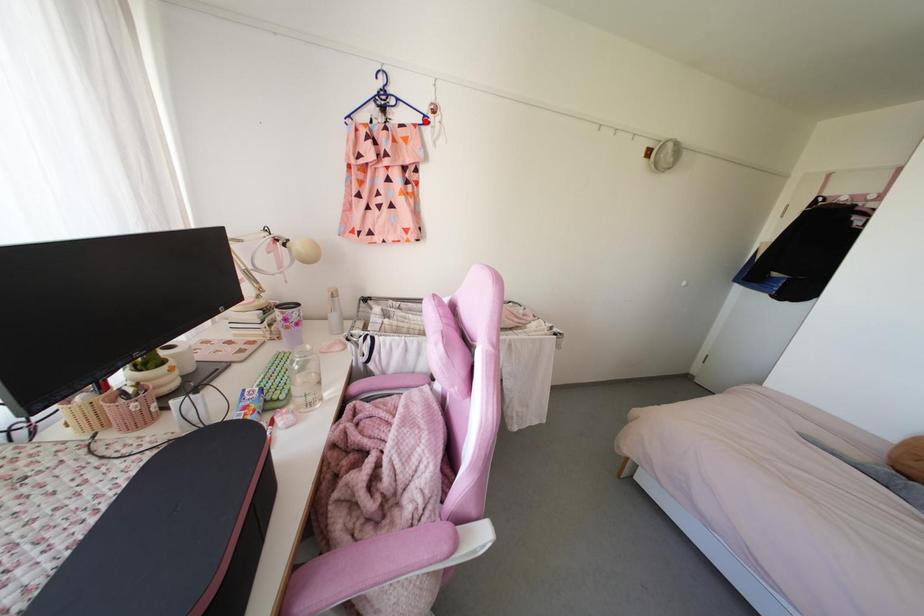
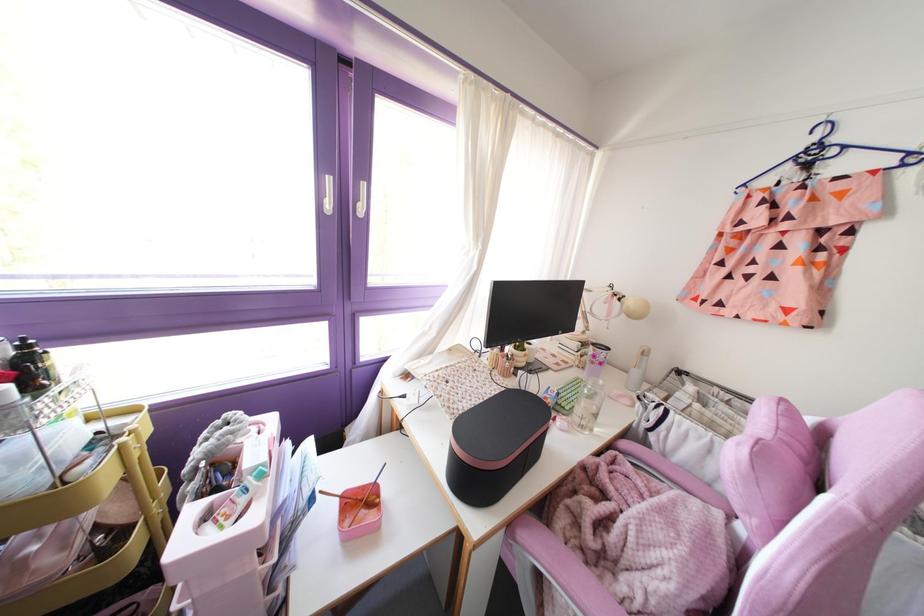
Question: I am providing you with two images of the same scene from different viewpoints. Given a red point in image1, look at the same physical point in image2. Is it:

Choices:
 (A) Closer to the viewpoint
 (B) Farther from the viewpoint

Answer: (B)